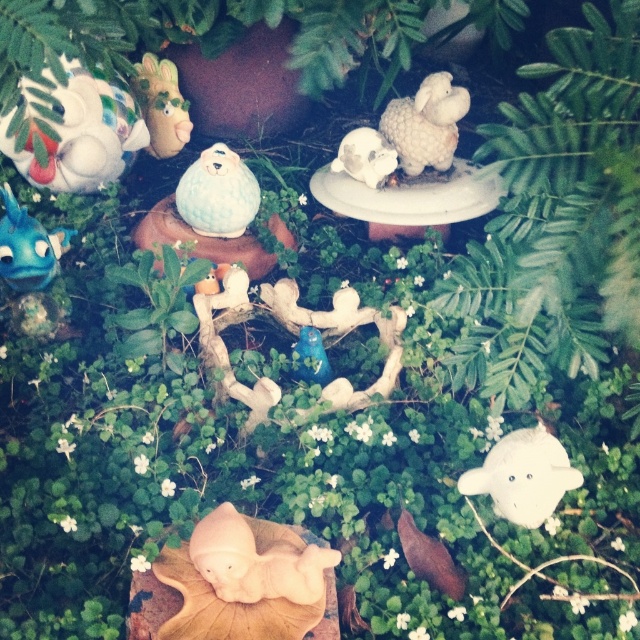
Who is more distant from viewer, (426, 134) or (220, 236)?

Point (220, 236)

Which is behind, point (435, 113) or point (252, 182)?

The point (252, 182) is behind.

The image size is (640, 640). I want to click on matte white sheep at upper right, so tap(426, 124).

Is matte white sheep at upper right smaller than matte ceramic rabbit at upper left?

Incorrect, matte white sheep at upper right is not smaller in size than matte ceramic rabbit at upper left.

The image size is (640, 640). What do you see at coordinates (426, 124) in the screenshot?
I see `matte white sheep at upper right` at bounding box center [426, 124].

What do you see at coordinates (426, 124) in the screenshot?
I see `matte white sheep at upper right` at bounding box center [426, 124].

The width and height of the screenshot is (640, 640). What are the coordinates of `matte white sheep at upper right` in the screenshot? It's located at (426, 124).

Is the position of matte blue egg at center more distant than that of white glossy skull at center?

No, matte blue egg at center is in front of white glossy skull at center.

Looking at this image, is matte blue egg at center thinner than white glossy skull at center?

Incorrect, matte blue egg at center's width is not less than white glossy skull at center's.

Who is more forward, (234,236) or (378,173)?

Point (378,173) is in front.

Locate an element on the screen. This screenshot has width=640, height=640. matte blue egg at center is located at coordinates (218, 193).